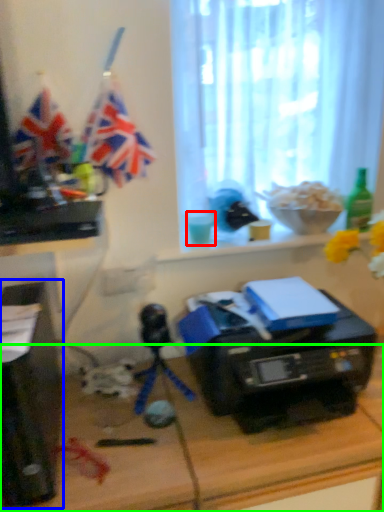
Question: Which object is positioned farthest from coffee cup (highlighted by a red box)? Select from desktop computer (highlighted by a blue box) and desk (highlighted by a green box).

Choices:
 (A) desktop computer
 (B) desk

Answer: (A)